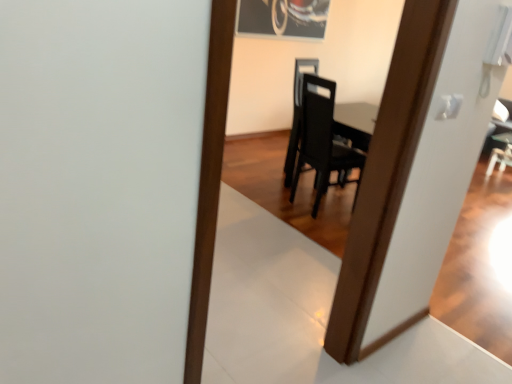
Question: Does black matte chair at center have a smaller size compared to metallic silver picture frame at upper center?

Choices:
 (A) yes
 (B) no

Answer: (B)

Question: Is the position of black matte chair at center more distant than that of metallic silver picture frame at upper center?

Choices:
 (A) no
 (B) yes

Answer: (A)

Question: Does black matte chair at center have a larger size compared to metallic silver picture frame at upper center?

Choices:
 (A) yes
 (B) no

Answer: (A)

Question: Can you confirm if black matte chair at center is shorter than metallic silver picture frame at upper center?

Choices:
 (A) no
 (B) yes

Answer: (A)

Question: From the image's perspective, is black matte chair at center located above metallic silver picture frame at upper center?

Choices:
 (A) no
 (B) yes

Answer: (A)

Question: From a real-world perspective, is black matte chair at center physically above metallic silver picture frame at upper center?

Choices:
 (A) yes
 (B) no

Answer: (B)

Question: Is metallic silver picture frame at upper center positioned far away from black matte chair at center?

Choices:
 (A) no
 (B) yes

Answer: (B)

Question: Is metallic silver picture frame at upper center aimed at black matte chair at center?

Choices:
 (A) no
 (B) yes

Answer: (A)

Question: Is metallic silver picture frame at upper center smaller than black matte chair at center?

Choices:
 (A) yes
 (B) no

Answer: (A)

Question: From a real-world perspective, is metallic silver picture frame at upper center physically below black matte chair at center?

Choices:
 (A) no
 (B) yes

Answer: (A)

Question: Is black matte chair at center located within metallic silver picture frame at upper center?

Choices:
 (A) no
 (B) yes

Answer: (A)

Question: Is metallic silver picture frame at upper center at the right side of black matte chair at center?

Choices:
 (A) no
 (B) yes

Answer: (A)

Question: In terms of height, does metallic silver picture frame at upper center look taller or shorter compared to black matte chair at center?

Choices:
 (A) short
 (B) tall

Answer: (A)